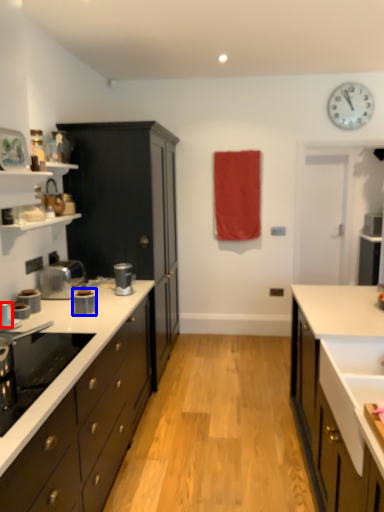
Question: Which object is closer to the camera taking this photo, kitchen appliance (highlighted by a red box) or kitchen appliance (highlighted by a blue box)?

Choices:
 (A) kitchen appliance
 (B) kitchen appliance

Answer: (A)